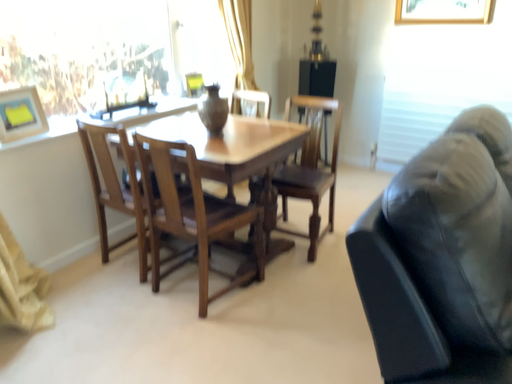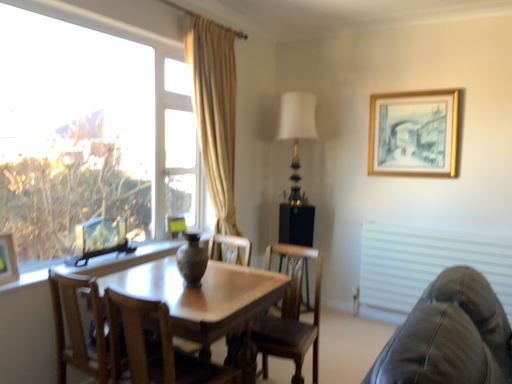
Question: How did the camera likely rotate when shooting the video?

Choices:
 (A) rotated upward
 (B) rotated downward

Answer: (A)